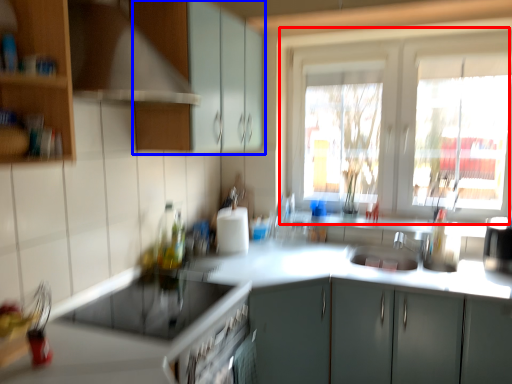
Question: Which object appears farthest to the camera in this image, window (highlighted by a red box) or cabinetry (highlighted by a blue box)?

Choices:
 (A) window
 (B) cabinetry

Answer: (A)